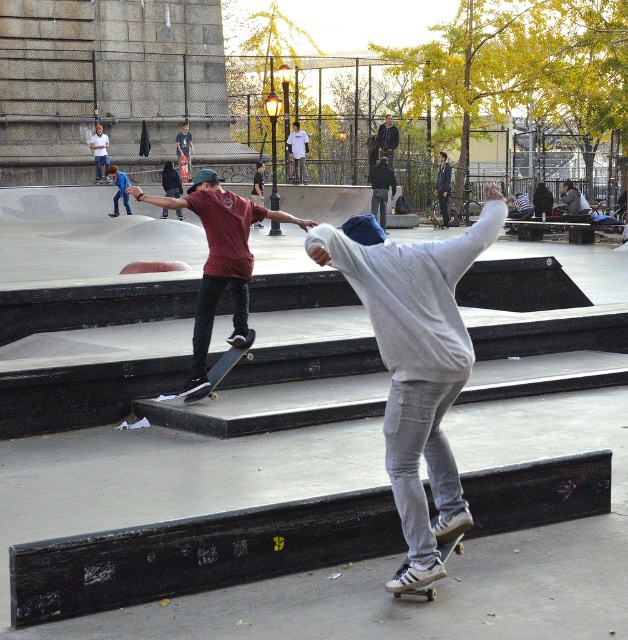
Based on the photo, which is below, gray cotton hoodie at center or black matte skateboard at center?

Positioned lower is black matte skateboard at center.

Is the position of gray cotton hoodie at center more distant than that of black matte skateboard at center?

No.

Between point (447, 506) and point (230, 356), which one is positioned behind?

The point (230, 356) is more distant.

The width and height of the screenshot is (628, 640). Find the location of `gray cotton hoodie at center`. gray cotton hoodie at center is located at coordinates (416, 364).

Which is behind, point (379, 224) or point (462, 547)?

Point (379, 224)

Find the location of `dark green jacket at center`. dark green jacket at center is located at coordinates (381, 188).

Is point (403, 477) positioned in front of point (403, 570)?

Yes, point (403, 477) is closer to viewer.

Based on the photo, is gray cotton hoodie at center below wooden skateboard at center?

Actually, gray cotton hoodie at center is above wooden skateboard at center.

Is point (403, 401) farther from camera compared to point (409, 589)?

That is False.

The height and width of the screenshot is (640, 628). What are the coordinates of `gray cotton hoodie at center` in the screenshot? It's located at (416, 364).